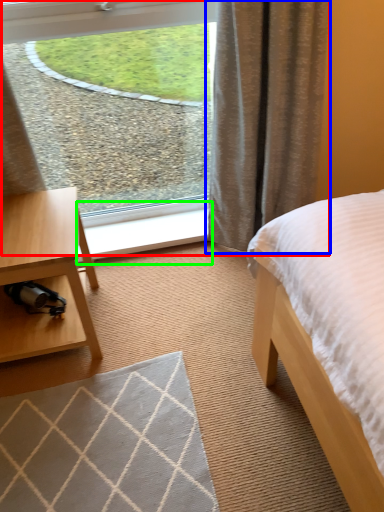
Question: Based on their relative distances, which object is nearer to window (highlighted by a red box)? Choose from curtain (highlighted by a blue box) and window sill (highlighted by a green box).

Choices:
 (A) curtain
 (B) window sill

Answer: (A)